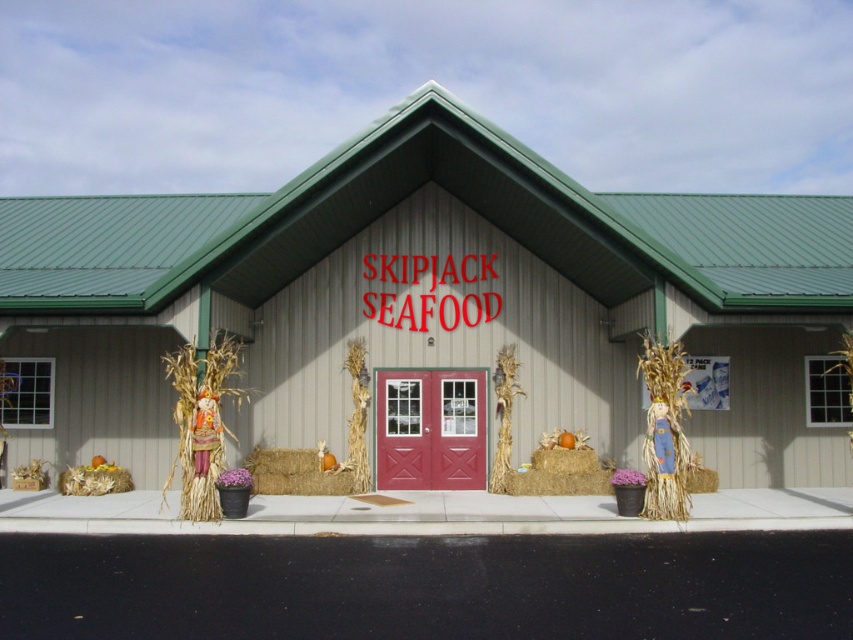
Which of these two, yellow straw bale at lower left or braided straw hay at lower right, stands shorter?

yellow straw bale at lower left

Between yellow straw bale at lower left and braided straw hay at lower right, which one appears on the left side from the viewer's perspective?

From the viewer's perspective, yellow straw bale at lower left appears more on the left side.

Identify the location of yellow straw bale at lower left. This screenshot has height=640, width=853. (94, 480).

Who is shorter, gray siding at center or bleached straw bale at center?

Standing shorter between the two is bleached straw bale at center.

Between point (157, 301) and point (311, 470), which one is positioned in front?

Point (157, 301) is in front.

At what (x,y) coordinates should I click in order to perform the action: click on gray siding at center. Please return your answer as a coordinate pair (x, y). This screenshot has width=853, height=640. Looking at the image, I should click on (431, 296).

How distant is gray siding at center from yellow straw bale at lower left?

The distance of gray siding at center from yellow straw bale at lower left is 4.51 meters.

Can you confirm if gray siding at center is bigger than yellow straw bale at lower left?

Correct, gray siding at center is larger in size than yellow straw bale at lower left.

What do you see at coordinates (431, 296) in the screenshot?
I see `gray siding at center` at bounding box center [431, 296].

Identify the location of gray siding at center. Image resolution: width=853 pixels, height=640 pixels. (431, 296).